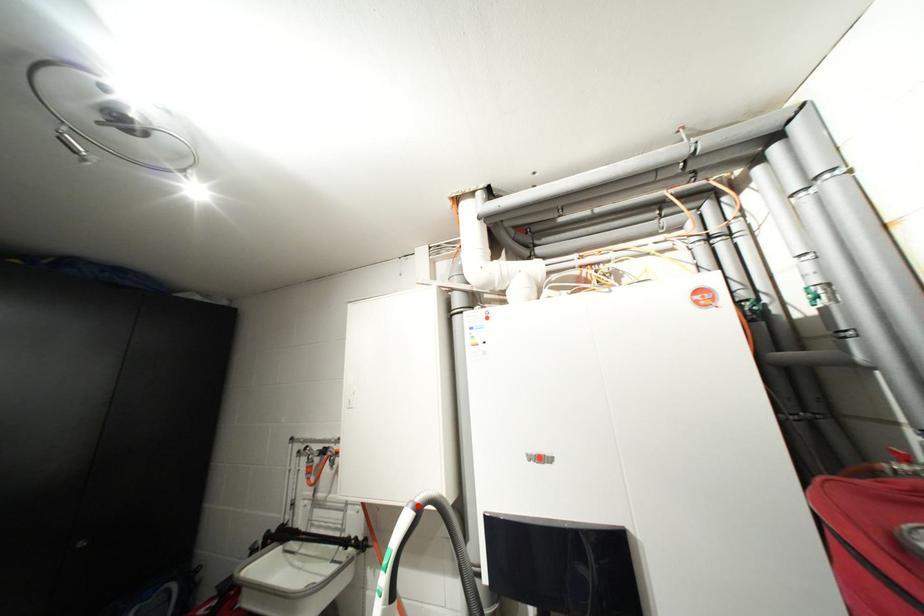
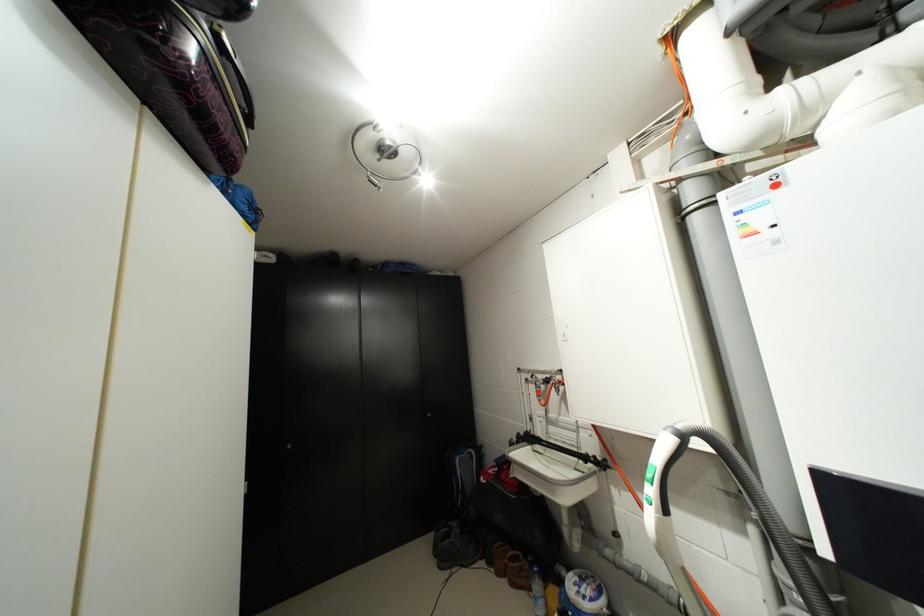
Find the pixel in the second image that matches the highlighted location in the first image.

(676, 431)